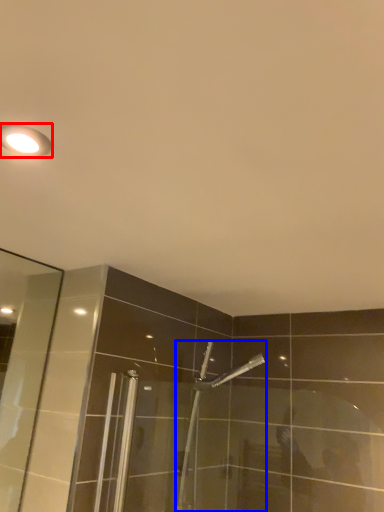
Question: Among these objects, which one is nearest to the camera, light fixture (highlighted by a red box) or shower (highlighted by a blue box)?

Choices:
 (A) light fixture
 (B) shower

Answer: (A)